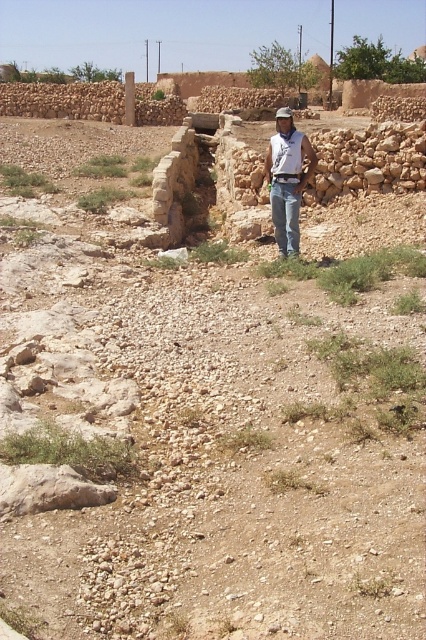
Question: From the image, what is the correct spatial relationship of white denim jeans at center in relation to denim at center?

Choices:
 (A) above
 (B) below

Answer: (A)

Question: Estimate the real-world distances between objects in this image. Which object is farther from the brown fabric baseball hat at center?

Choices:
 (A) white denim jeans at center
 (B) denim at center

Answer: (A)

Question: Which point is farther to the camera?

Choices:
 (A) coord(287,129)
 (B) coord(284,116)
 (C) coord(296,227)

Answer: (C)

Question: Does white denim jeans at center appear under brown fabric baseball hat at center?

Choices:
 (A) no
 (B) yes

Answer: (B)

Question: Which object is farther from the camera taking this photo?

Choices:
 (A) brown fabric baseball hat at center
 (B) white denim jeans at center

Answer: (A)

Question: From the image, what is the correct spatial relationship of white denim jeans at center in relation to brown fabric baseball hat at center?

Choices:
 (A) right
 (B) left

Answer: (B)